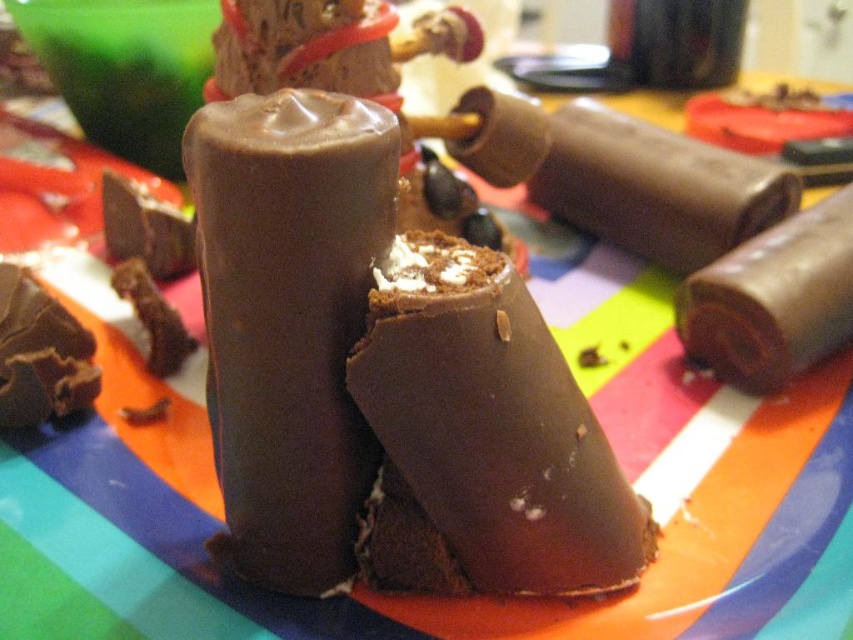
Question: Which of the following is the closest to the observer?

Choices:
 (A) chocolatesmoothcandy at center
 (B) chocolate matte at center

Answer: (B)

Question: Is chocolate matte at center positioned at the back of chocolate matte at upper right?

Choices:
 (A) no
 (B) yes

Answer: (A)

Question: In this image, where is chocolate matte at center located relative to chocolate matte at upper right?

Choices:
 (A) left
 (B) right

Answer: (A)

Question: Among these points, which one is farthest from the camera?

Choices:
 (A) (547, 166)
 (B) (380, 275)
 (C) (358, 138)

Answer: (A)

Question: Which point is closer to the camera?

Choices:
 (A) (775, 275)
 (B) (393, 410)

Answer: (B)

Question: Can you confirm if chocolate matte at center is smaller than chocolate matte at upper right?

Choices:
 (A) no
 (B) yes

Answer: (B)